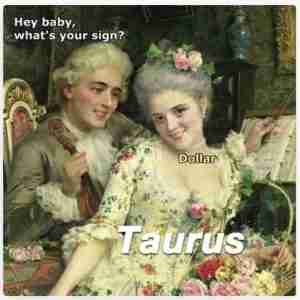
You are a GUI agent. You are given a task and a screenshot of the screen. Output one action in this format:
    pyautogui.click(x=<x>, y=<y>)
    Task: Click on the vase
    This screenshot has width=300, height=300.
    Given the screenshot: What is the action you would take?
    pyautogui.click(x=240, y=32)